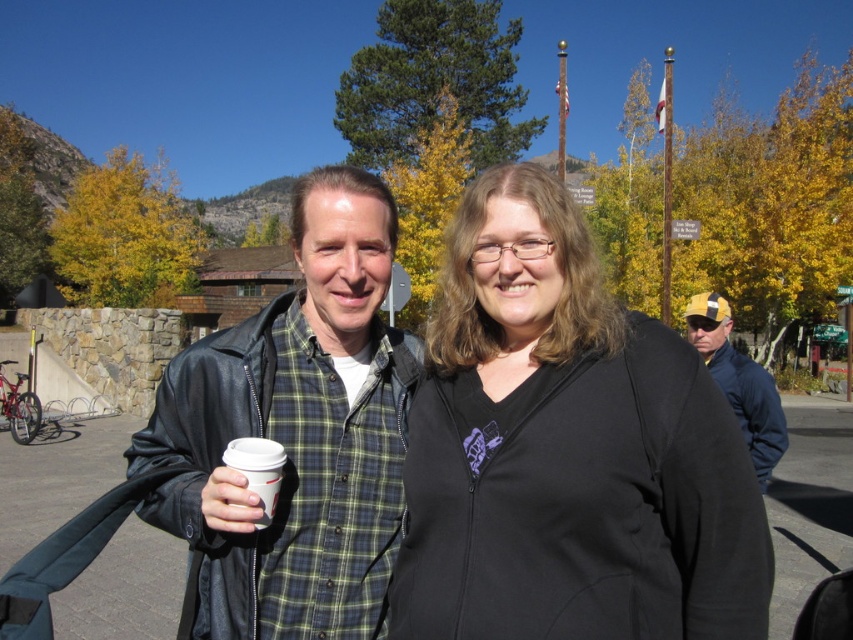
You are a photographer trying to capture a clear shot of the leather jacket at center and the white paper cup at center. Which object should you focus on first if you want to ensure both are in focus without adjusting your camera settings?

The leather jacket at center is above the white paper cup at center, so focusing on the leather jacket at center first would help ensure both are in focus since it is closer to the camera.

You are standing at the point marked by the coordinate (294, 435). What object is located exactly at this point?

The leather jacket at center is located exactly at the point marked by the coordinate (294, 435).